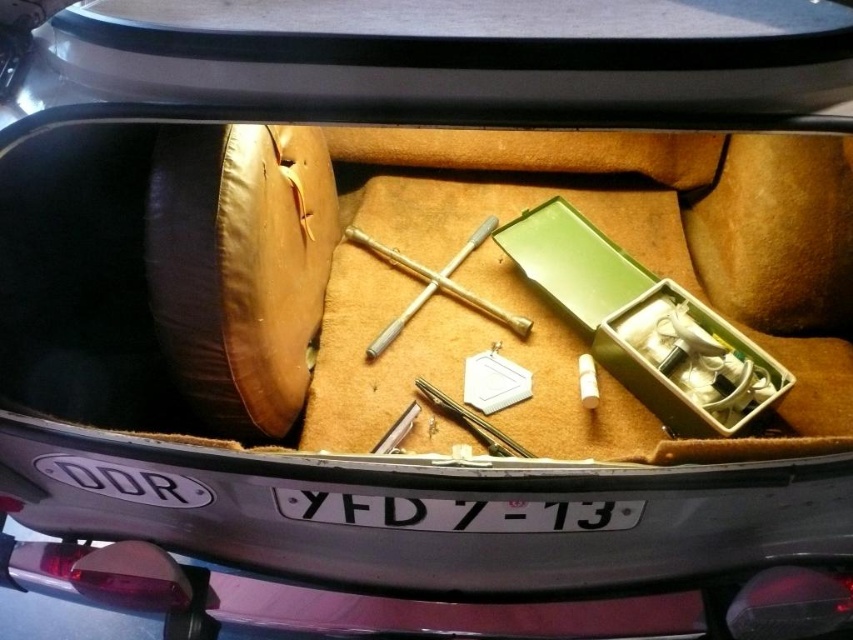
Question: Is brass/bronze metal wrench at center above metallic silver tool at center?

Choices:
 (A) no
 (B) yes

Answer: (B)

Question: Does brass/bronze metal wrench at center have a larger size compared to metallic silver tool at center?

Choices:
 (A) no
 (B) yes

Answer: (B)

Question: Which point is closer to the camera?

Choices:
 (A) brass/bronze metal wrench at center
 (B) metallic silver tool at center

Answer: (B)

Question: Which of the following is the farthest from the observer?

Choices:
 (A) (453, 406)
 (B) (483, 225)

Answer: (B)

Question: Does brass/bronze metal wrench at center have a smaller size compared to metallic silver tool at center?

Choices:
 (A) yes
 (B) no

Answer: (B)